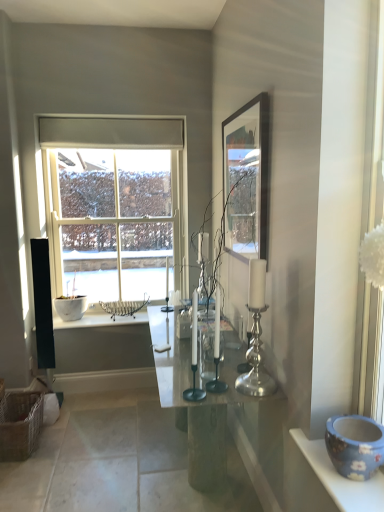
At what (x,y) coordinates should I click in order to perform the action: click on polished glass table at center. Please return your answer as a coordinate pair (x, y). The height and width of the screenshot is (512, 384). Looking at the image, I should click on (210, 404).

Measure the distance between point (258, 128) and camera.

Point (258, 128) is 6.92 feet away from camera.

This screenshot has width=384, height=512. What do you see at coordinates (114, 204) in the screenshot?
I see `clear glass window at center` at bounding box center [114, 204].

This screenshot has height=512, width=384. What do you see at coordinates (194, 356) in the screenshot? I see `silver metallic candle holder at center, the third candle holder viewed from the right` at bounding box center [194, 356].

What do you see at coordinates (255, 362) in the screenshot? The height and width of the screenshot is (512, 384). I see `silver metallic candle holder at center-right, the first candle holder in the right-to-left sequence` at bounding box center [255, 362].

The height and width of the screenshot is (512, 384). I want to click on silver metallic candle holder at center, the second candle holder when ordered from left to right, so click(x=213, y=361).

At what (x,y) coordinates should I click in order to perform the action: click on white glossy counter top at lower left. Please return your answer as a coordinate pair (x, y). Image resolution: width=384 pixels, height=512 pixels. Looking at the image, I should click on (100, 320).

Identify the location of polished glass table at center. (210, 404).

Which object is closer to the camera, clear glass window at center or blue ceramic bowl at lower right?

blue ceramic bowl at lower right is in front.

From the image's perspective, is clear glass window at center located above or below blue ceramic bowl at lower right?

Based on their image positions, clear glass window at center is located above blue ceramic bowl at lower right.

Is clear glass window at center facing away from blue ceramic bowl at lower right?

No, blue ceramic bowl at lower right is not at the back of clear glass window at center.

Is clear glass window at center thinner than blue ceramic bowl at lower right?

Indeed, clear glass window at center has a lesser width compared to blue ceramic bowl at lower right.

Which object is more forward, white glossy counter top at lower left or clear glass window at center?

clear glass window at center is closer to the camera.

Is white glossy counter top at lower left oriented away from clear glass window at center?

No, clear glass window at center is not at the back of white glossy counter top at lower left.

The image size is (384, 512). I want to click on window on the right of white glossy counter top at lower left, so click(114, 204).

From the image's perspective, which object appears higher, white glossy counter top at lower left or clear glass window at center?

clear glass window at center.

Looking at this image, from a real-world perspective, between polished glass table at center and clear glass window at center, who is vertically lower?

polished glass table at center, from a real-world perspective.

The height and width of the screenshot is (512, 384). Find the location of `table located below the clear glass window at center (from the image's perspective)`. table located below the clear glass window at center (from the image's perspective) is located at coordinates (210, 404).

Between polished glass table at center and clear glass window at center, which one has smaller width?

clear glass window at center.

Is clear glass window at center surrounded by polished glass table at center?

Actually, clear glass window at center is outside polished glass table at center.

How different are the orientations of polished glass table at center and silver metallic candle holder at center, the third candle holder viewed from the right, in degrees?

polished glass table at center and silver metallic candle holder at center, the third candle holder viewed from the right, are facing 0.998 degrees away from each other.

Can you confirm if polished glass table at center is bigger than silver metallic candle holder at center, the first candle holder from the left?

Yes.

Considering the positions of objects polished glass table at center and silver metallic candle holder at center, the third candle holder viewed from the right, in the image provided, who is behind, polished glass table at center or silver metallic candle holder at center, the third candle holder viewed from the right,?

polished glass table at center.

Locate an element on the screen. table that is below the silver metallic candle holder at center, the third candle holder viewed from the right (from the image's perspective) is located at coordinates (210, 404).

Is point (186, 389) farther from viewer compared to point (266, 418)?

No, it is in front of (266, 418).

Is silver metallic candle holder at center, the third candle holder viewed from the right, next to polished glass table at center?

No, silver metallic candle holder at center, the third candle holder viewed from the right, is not next to polished glass table at center.

Which is more to the right, silver metallic candle holder at center, the first candle holder from the left, or polished glass table at center?

polished glass table at center.

Do you think silver metallic candle holder at center, the third candle holder viewed from the right, is within polished glass table at center, or outside of it?

silver metallic candle holder at center, the third candle holder viewed from the right, cannot be found inside polished glass table at center.

From the image's perspective, count 1st candle holders upward from the silver metallic candle holder at center, the third candle holder viewed from the right, and point to it. Please provide its 2D coordinates.

[(213, 361)]

Is silver metallic candle holder at center, the second candle holder when ordered from left to right, located within silver metallic candle holder at center, the first candle holder from the left?

Result: No, silver metallic candle holder at center, the first candle holder from the left, does not contain silver metallic candle holder at center, the second candle holder when ordered from left to right.

Looking at this image, which is in front, silver metallic candle holder at center, the third candle holder viewed from the right, or silver metallic candle holder at center, the second candle holder when ordered from left to right?

silver metallic candle holder at center, the third candle holder viewed from the right, is more forward.

Looking at this image, could you measure the distance between silver metallic candle holder at center, the first candle holder from the left, and silver metallic candle holder at center, the second candle holder when ordered from left to right?

silver metallic candle holder at center, the first candle holder from the left, is 6.03 inches from silver metallic candle holder at center, the second candle holder when ordered from left to right.

Which object is thinner, polished glass table at center or blue ceramic bowl at lower right?

Thinner between the two is blue ceramic bowl at lower right.

From a real-world perspective, who is located lower, polished glass table at center or blue ceramic bowl at lower right?

In real-world perspective, polished glass table at center is lower.

Does polished glass table at center turn towards blue ceramic bowl at lower right?

No, polished glass table at center is not facing towards blue ceramic bowl at lower right.

Are polished glass table at center and blue ceramic bowl at lower right making contact?

No.

Identify the location of window above the blue ceramic bowl at lower right (from the image's perspective). This screenshot has width=384, height=512. pos(114,204).

The height and width of the screenshot is (512, 384). Identify the location of counter top that appears below the clear glass window at center (from a real-world perspective). (100, 320).

From the image, which object appears to be nearer to clear glass window at center, white glossy counter top at lower left or silver metallic candle holder at center-right, the first candle holder in the right-to-left sequence?

white glossy counter top at lower left is positioned closer to the anchor clear glass window at center.

Looking at this image, when comparing their distances from white glossy counter top at lower left, does polished glass table at center or silver metallic candle holder at center, the second candle holder in the right-to-left sequence, seem closer?

Among the two, polished glass table at center is located nearer to white glossy counter top at lower left.

When comparing their distances from silver metallic candle holder at center, the second candle holder when ordered from left to right, does polished glass table at center or silver metallic candle holder at center, the third candle holder viewed from the right, seem closer?

Among the two, silver metallic candle holder at center, the third candle holder viewed from the right, is located nearer to silver metallic candle holder at center, the second candle holder when ordered from left to right.

Considering their positions, is silver metallic candle holder at center, the second candle holder when ordered from left to right, positioned closer to blue ceramic bowl at lower right than clear glass window at center?

Based on the image, silver metallic candle holder at center, the second candle holder when ordered from left to right, appears to be nearer to blue ceramic bowl at lower right.

When comparing their distances from polished glass table at center, does white glossy counter top at lower left or silver metallic candle holder at center, the second candle holder in the right-to-left sequence, seem closer?

silver metallic candle holder at center, the second candle holder in the right-to-left sequence, lies closer to polished glass table at center than the other object.

Estimate the real-world distances between objects in this image. Which object is further from silver metallic candle holder at center, the third candle holder viewed from the right, blue ceramic bowl at lower right or silver metallic candle holder at center, the second candle holder in the right-to-left sequence?

blue ceramic bowl at lower right is positioned further to the anchor silver metallic candle holder at center, the third candle holder viewed from the right.

Based on the photo, based on their spatial positions, is wooden frame at upper right or silver metallic candle holder at center-right, the first candle holder in the right-to-left sequence, further from blue ceramic bowl at lower right?

Based on the image, wooden frame at upper right appears to be further to blue ceramic bowl at lower right.

In the scene shown: When comparing their distances from silver metallic candle holder at center, the second candle holder when ordered from left to right, does clear glass window at center or white glossy counter top at lower left seem closer?

white glossy counter top at lower left lies closer to silver metallic candle holder at center, the second candle holder when ordered from left to right, than the other object.

At what (x,y) coordinates should I click in order to perform the action: click on window between silver metallic candle holder at center-right, acting as the third candle holder starting from the left, and white glossy counter top at lower left in the front-back direction. Please return your answer as a coordinate pair (x, y). This screenshot has width=384, height=512. Looking at the image, I should click on (114, 204).

Find the location of `candle holder between silver metallic candle holder at center, the second candle holder in the right-to-left sequence, and polished glass table at center vertically`. candle holder between silver metallic candle holder at center, the second candle holder in the right-to-left sequence, and polished glass table at center vertically is located at coordinates (194, 356).

Locate an element on the screen. The image size is (384, 512). picture frame positioned between silver metallic candle holder at center, the second candle holder when ordered from left to right, and white glossy counter top at lower left from near to far is located at coordinates (246, 179).

Locate an element on the screen. This screenshot has width=384, height=512. candle holder between silver metallic candle holder at center-right, acting as the third candle holder starting from the left, and white glossy counter top at lower left, along the z-axis is located at coordinates (213, 361).